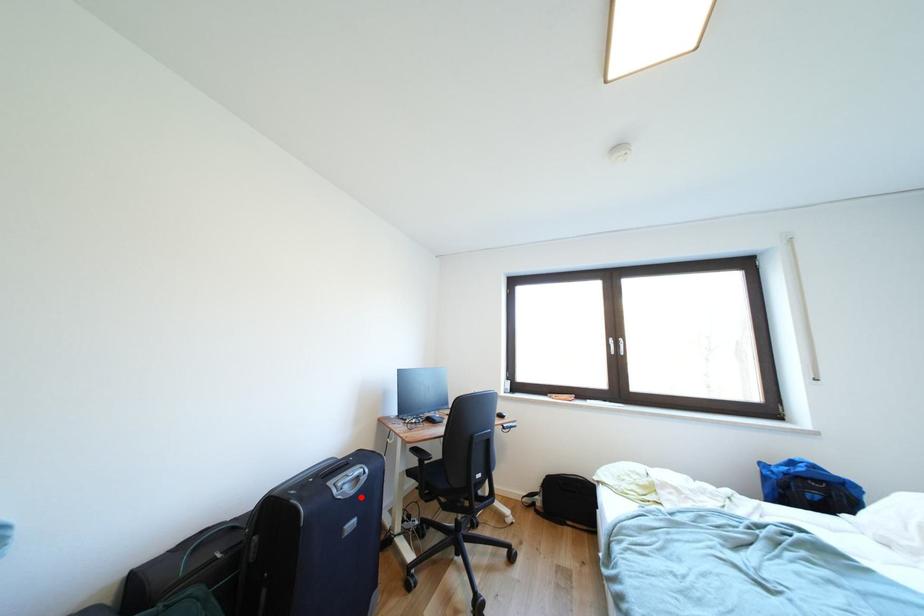
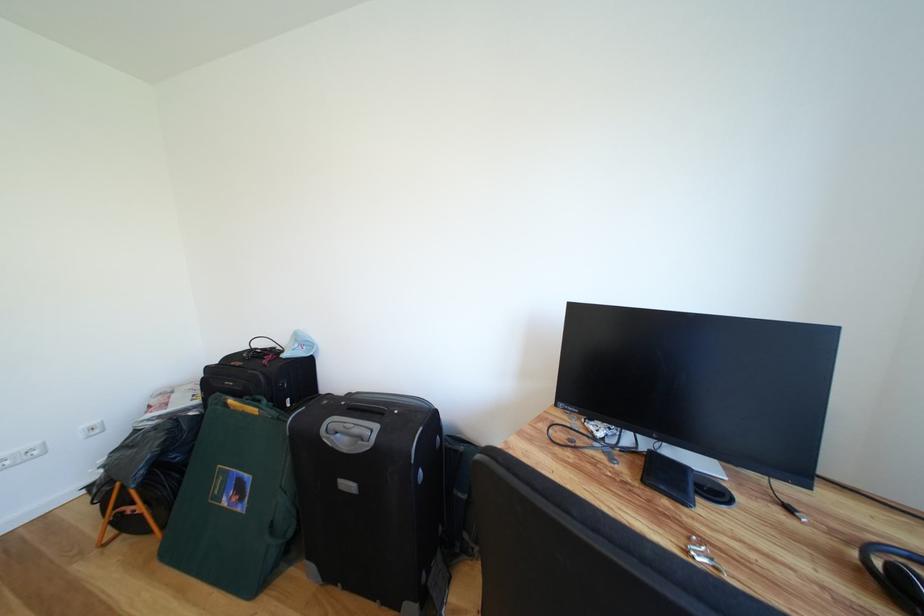
Find the pixel in the second image that matches the highlighted location in the first image.

(353, 455)